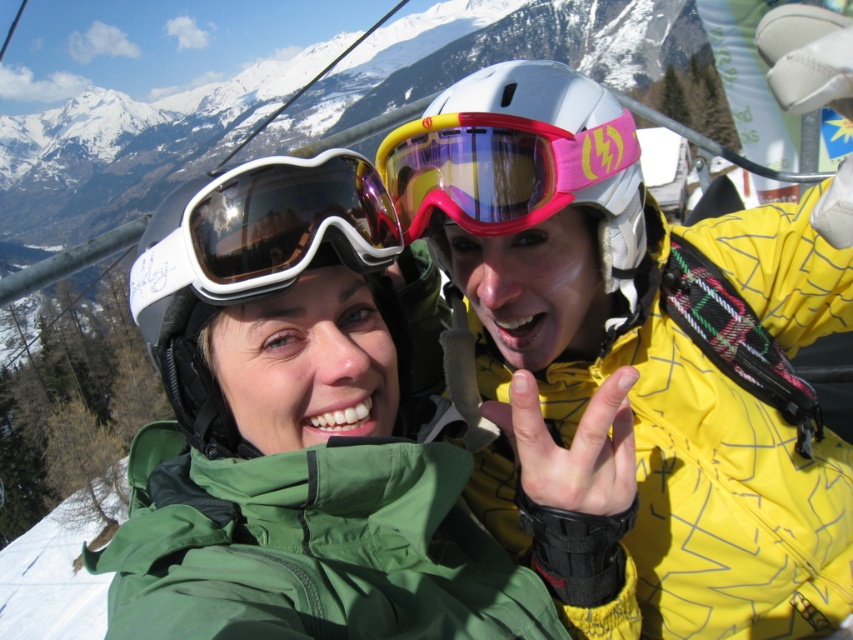
You are a photographer standing at the bottom of the ski slope. You need to take a photo of both the green fabric jacket at center and the white matte ski goggles at center. Which object should you focus on first to ensure both are in the frame?

The green fabric jacket at center is positioned under the white matte ski goggles at center, so you should focus on the white matte ski goggles at center first to ensure both are in the frame.

You are a photographer trying to capture a photo of the green fabric jacket at center and the pink matte ski goggles at center. Based on their positions, which object should you focus on first if you want to ensure both are in the frame without moving the camera?

The green fabric jacket at center is below the pink matte ski goggles at center. Since the jacket is lower, you should focus on the pink matte ski goggles at center first to ensure the entire frame captures both objects without needing to adjust the camera angle.

You are a photographer trying to capture a clear photo of the green fabric jacket at center and the white matte ski goggles at center. Since you want both objects to appear equally large in the photo, which object should you move closer to the camera?

The white matte ski goggles at center should be moved closer to the camera because it is smaller than the green fabric jacket at center. To make them appear the same size in the photo, the smaller object needs to be closer.